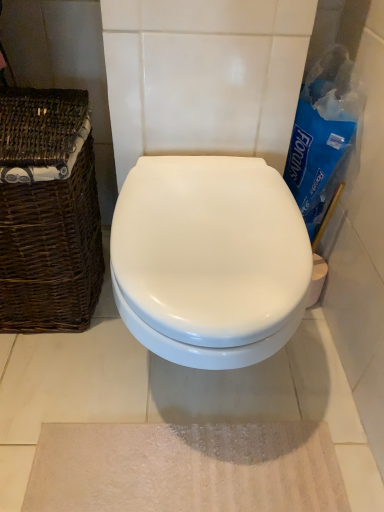
Question: From the image's perspective, is white glossy toilet at center over brown woven basket at left?

Choices:
 (A) no
 (B) yes

Answer: (A)

Question: Does white glossy toilet at center lie in front of brown woven basket at left?

Choices:
 (A) yes
 (B) no

Answer: (A)

Question: Is white glossy toilet at center facing towards brown woven basket at left?

Choices:
 (A) yes
 (B) no

Answer: (B)

Question: Does white glossy toilet at center appear on the left side of brown woven basket at left?

Choices:
 (A) no
 (B) yes

Answer: (A)

Question: Is white glossy toilet at center not within brown woven basket at left?

Choices:
 (A) no
 (B) yes

Answer: (B)

Question: From the image's perspective, relative to beige textured bath mat at lower center, is brown woven basket at left above or below?

Choices:
 (A) above
 (B) below

Answer: (A)

Question: Is brown woven basket at left in front of or behind beige textured bath mat at lower center in the image?

Choices:
 (A) behind
 (B) front

Answer: (B)

Question: Visually, is brown woven basket at left positioned to the left or to the right of beige textured bath mat at lower center?

Choices:
 (A) left
 (B) right

Answer: (A)

Question: Is brown woven basket at left spatially inside beige textured bath mat at lower center, or outside of it?

Choices:
 (A) outside
 (B) inside

Answer: (A)

Question: From the image's perspective, is brown woven basket at left located above or below white glossy toilet at center?

Choices:
 (A) above
 (B) below

Answer: (A)

Question: Is point [x=67, y=216] positioned closer to the camera than point [x=283, y=335]?

Choices:
 (A) farther
 (B) closer

Answer: (A)

Question: Relative to white glossy toilet at center, is brown woven basket at left in front or behind?

Choices:
 (A) front
 (B) behind

Answer: (B)

Question: Is brown woven basket at left taller or shorter than white glossy toilet at center?

Choices:
 (A) short
 (B) tall

Answer: (B)

Question: Looking at the image, does beige textured bath mat at lower center seem bigger or smaller compared to white glossy toilet at center?

Choices:
 (A) small
 (B) big

Answer: (A)

Question: From a real-world perspective, is beige textured bath mat at lower center positioned above or below white glossy toilet at center?

Choices:
 (A) above
 (B) below

Answer: (B)